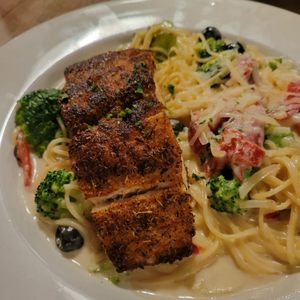
This screenshot has height=300, width=300. Find the location of `plate`. plate is located at coordinates (259, 30).